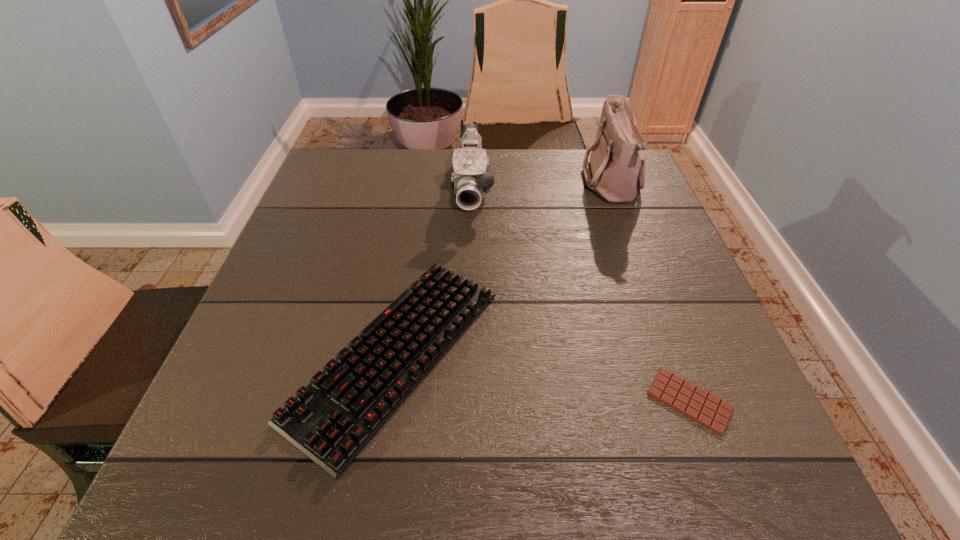
At what (x,y) coordinates should I click in order to perform the action: click on shoulder bag located at the far edge. Please return your answer as a coordinate pair (x, y). Looking at the image, I should click on (616, 171).

I want to click on camcorder that is positioned at the far edge, so click(470, 178).

Where is `computer keyboard located at the near edge`? The width and height of the screenshot is (960, 540). computer keyboard located at the near edge is located at coordinates (331, 420).

Locate an element on the screen. candy bar present at the near edge is located at coordinates (694, 402).

Locate an element on the screen. Image resolution: width=960 pixels, height=540 pixels. object located in the left edge section of the desktop is located at coordinates (331, 420).

The height and width of the screenshot is (540, 960). Identify the location of shoulder bag that is positioned at the right edge. (616, 171).

The height and width of the screenshot is (540, 960). Find the location of `candy bar positioned at the right edge`. candy bar positioned at the right edge is located at coordinates (694, 402).

The width and height of the screenshot is (960, 540). In order to click on object at the near left corner in this screenshot , I will do `click(331, 420)`.

At what (x,y) coordinates should I click in order to perform the action: click on object located at the far right corner. Please return your answer as a coordinate pair (x, y). The width and height of the screenshot is (960, 540). Looking at the image, I should click on (616, 171).

In order to click on object located at the near right corner in this screenshot , I will do `click(694, 402)`.